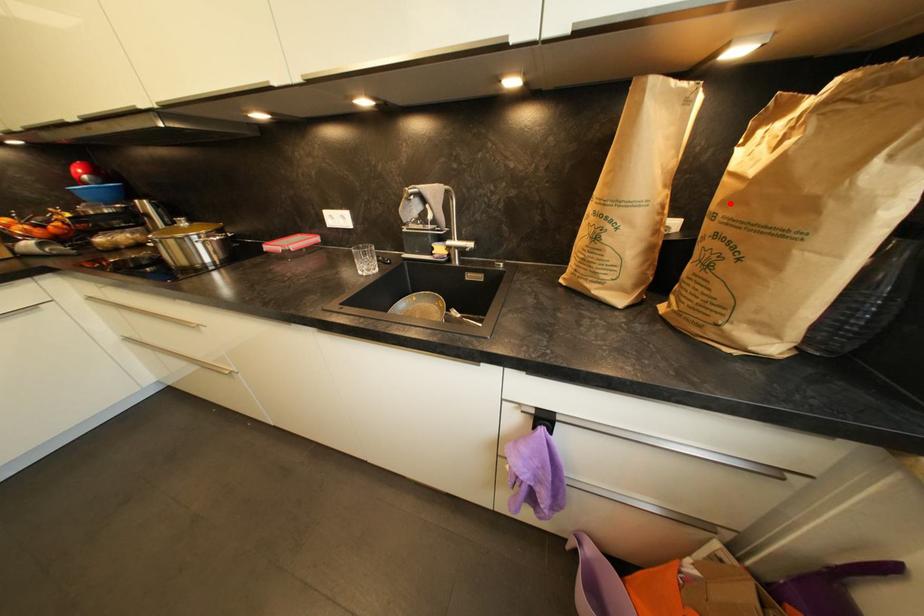
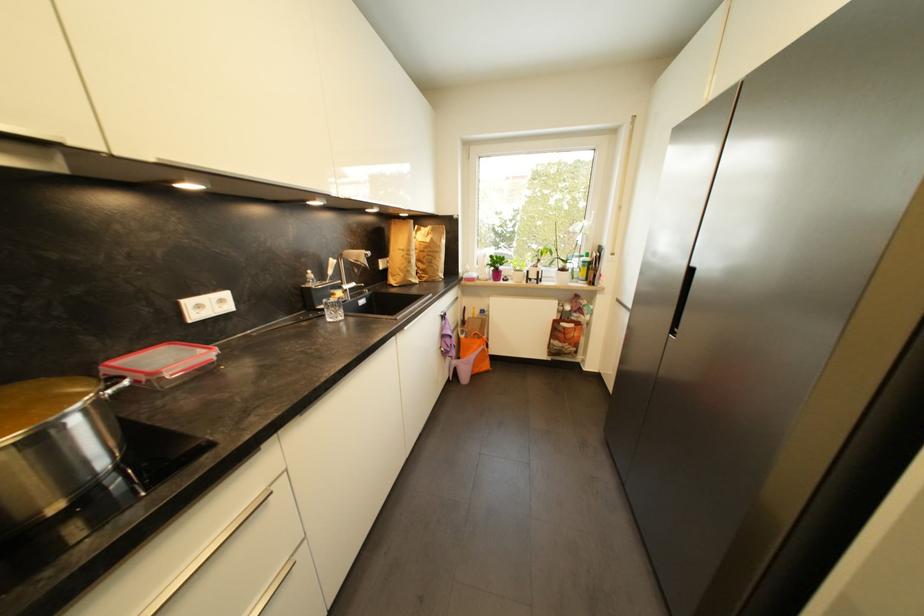
Where in the second image is the point corresponding to the highlighted location from the first image?

(430, 249)